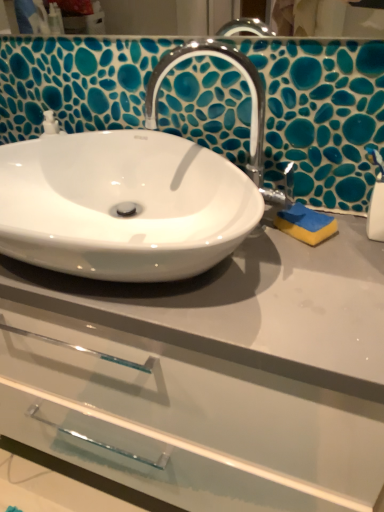
Question: In the image, is yellow sponge at right on the left side or the right side of white glossy sink at center?

Choices:
 (A) right
 (B) left

Answer: (A)

Question: Is point (311, 218) positioned closer to the camera than point (205, 222)?

Choices:
 (A) closer
 (B) farther

Answer: (B)

Question: Which object is the closest to the yellow sponge at right?

Choices:
 (A) chrome/polished metal faucet at center
 (B) white glossy sink at center
 (C) white glossy drawer at center
 (D) white plastic soap dispenser at right

Answer: (D)

Question: Based on their relative distances, which object is farther from the white glossy drawer at center?

Choices:
 (A) white glossy sink at center
 (B) white plastic soap dispenser at right
 (C) yellow sponge at right
 (D) chrome/polished metal faucet at center

Answer: (B)